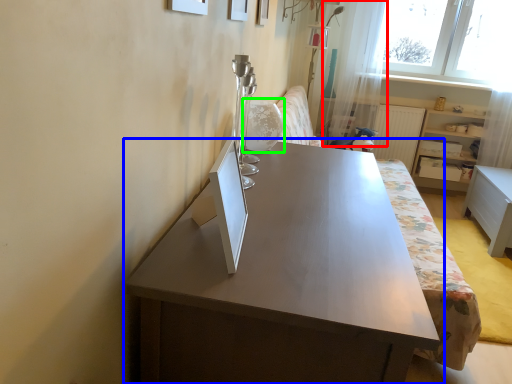
Question: Which is farther away from curtain (highlighted by a red box)? table (highlighted by a blue box) or swivel chair (highlighted by a green box)?

Choices:
 (A) table
 (B) swivel chair

Answer: (A)